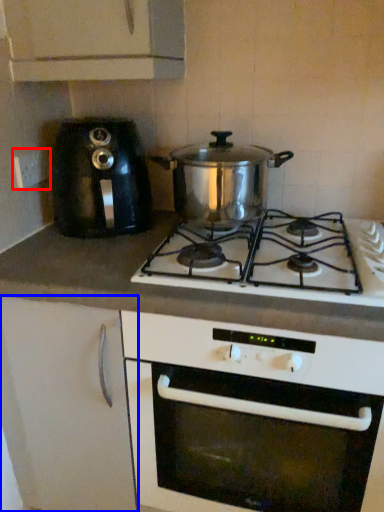
Question: Which object is closer to the camera taking this photo, electric outlet (highlighted by a red box) or cabinetry (highlighted by a blue box)?

Choices:
 (A) electric outlet
 (B) cabinetry

Answer: (B)